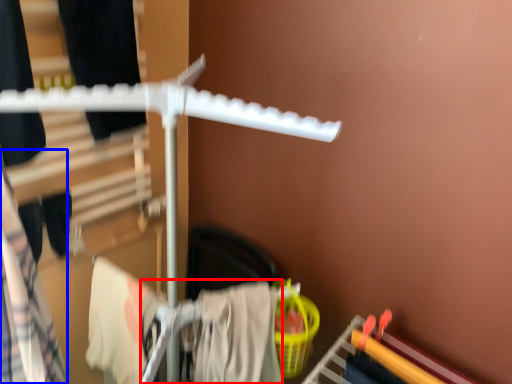
Question: Which object appears closest to the camera in this image, clothing (highlighted by a red box) or clothing (highlighted by a blue box)?

Choices:
 (A) clothing
 (B) clothing

Answer: (B)